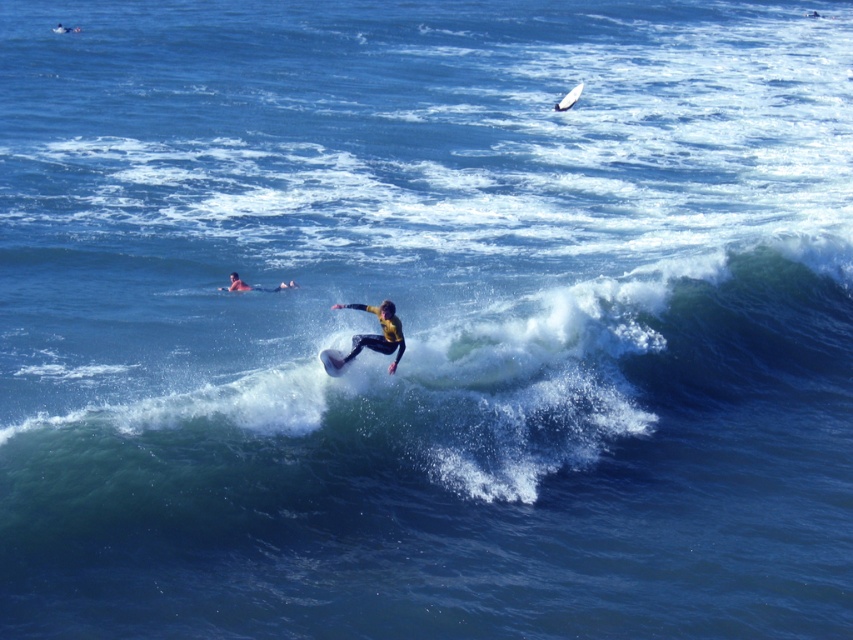
Question: Does yellow matte surfboard at center appear on the right side of white foam surfboard at center?

Choices:
 (A) yes
 (B) no

Answer: (A)

Question: Which point is farther from the camera taking this photo?

Choices:
 (A) (219, 288)
 (B) (334, 376)
 (C) (569, 106)

Answer: (C)

Question: Is white foam surfboard at center above smooth skin person at upper left?

Choices:
 (A) no
 (B) yes

Answer: (A)

Question: Which object is closer to the camera taking this photo?

Choices:
 (A) smooth skin person at upper left
 (B) white foam surfboard at center
 (C) white foam surfboard at upper right
 (D) yellow matte surfboard at center

Answer: (B)

Question: Is white foam surfboard at center to the left of smooth skin person at upper left from the viewer's perspective?

Choices:
 (A) no
 (B) yes

Answer: (A)

Question: Which object appears closest to the camera in this image?

Choices:
 (A) smooth skin person at upper left
 (B) white foam surfboard at center
 (C) white foam surfboard at upper right
 (D) yellow matte surfboard at center

Answer: (B)